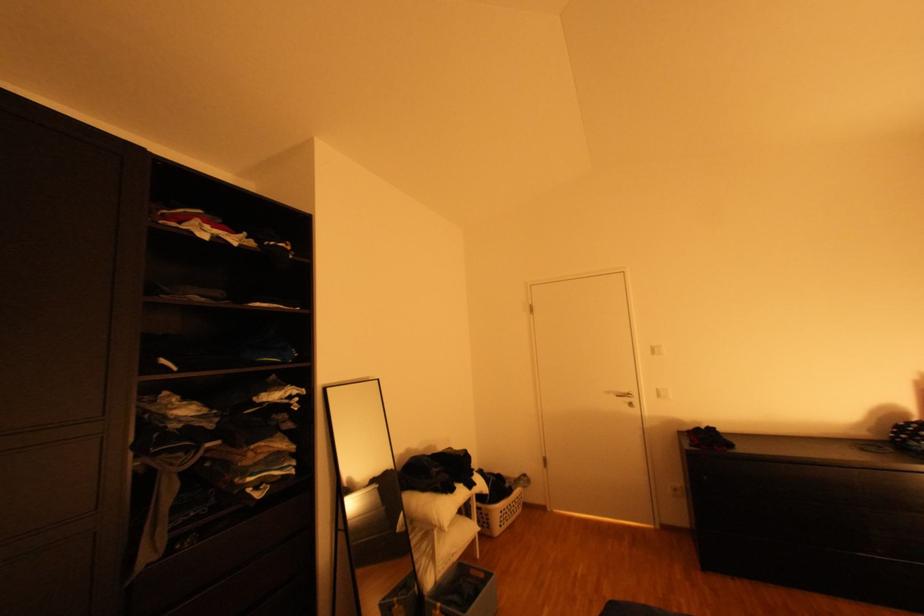
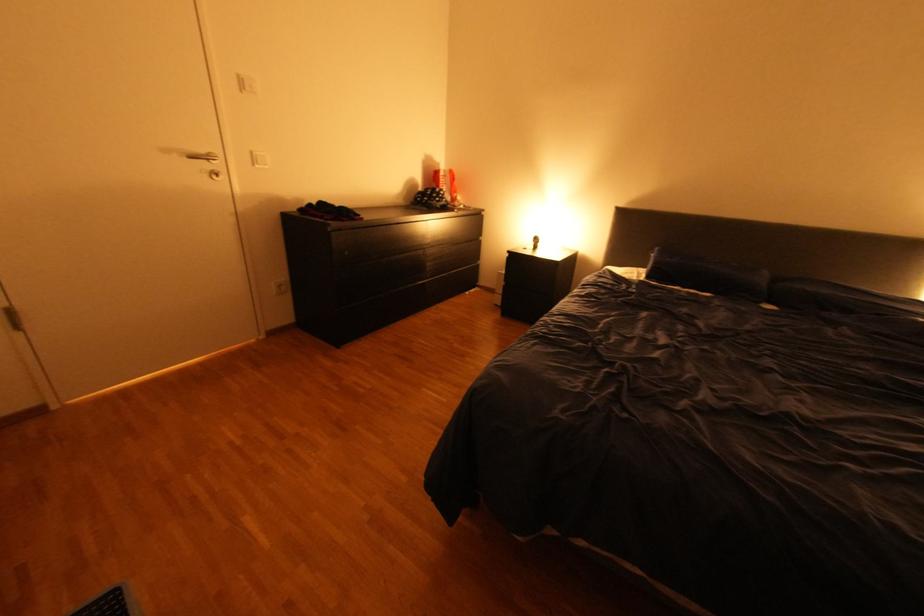
In the second image, find the point that corresponds to (715,477) in the first image.

(357, 253)